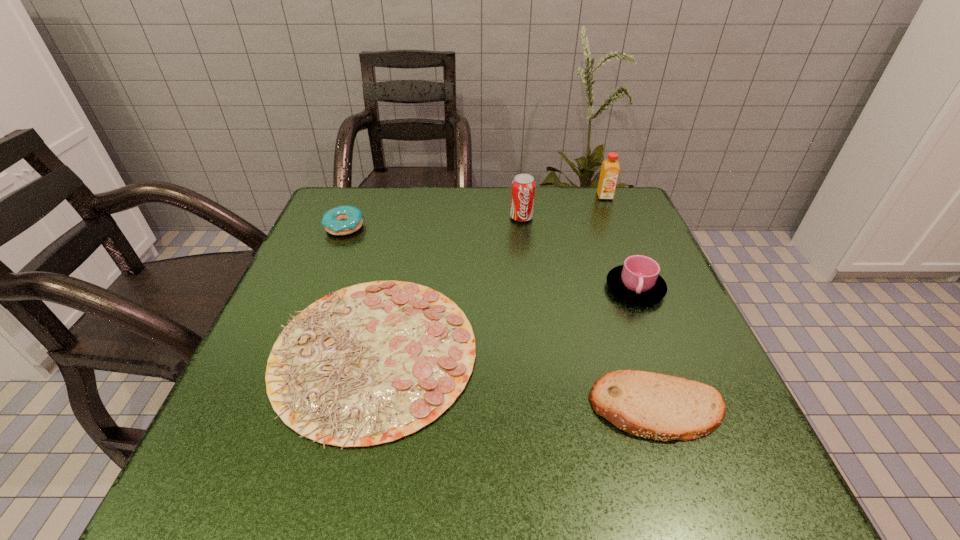
Locate an element on the screen. This screenshot has width=960, height=540. vacant region at the far left corner is located at coordinates (385, 192).

Find the location of a particular element. The width and height of the screenshot is (960, 540). free space at the near left corner is located at coordinates (194, 478).

Locate an element on the screen. This screenshot has height=540, width=960. vacant region at the far right corner of the desktop is located at coordinates (627, 195).

Locate an element on the screen. This screenshot has height=540, width=960. free point between the doughnut and the pita bread is located at coordinates (501, 318).

This screenshot has height=540, width=960. I want to click on blank region between the orange juice and the pizza, so click(490, 275).

I want to click on free space between the doughnut and the cup, so click(490, 258).

You are a GUI agent. You are given a task and a screenshot of the screen. Output one action in this format:
    pyautogui.click(x=<x>, y=<y>)
    Task: Click on the vacant region between the pita bread and the pizza
    
    Given the screenshot: What is the action you would take?
    pyautogui.click(x=516, y=381)

Image resolution: width=960 pixels, height=540 pixels. Find the location of `vacant space that's between the soda can and the doughnut`. vacant space that's between the soda can and the doughnut is located at coordinates (433, 222).

Locate an element on the screen. Image resolution: width=960 pixels, height=540 pixels. vacant area between the farthest object and the third tallest object is located at coordinates (620, 242).

The image size is (960, 540). I want to click on free space between the cup and the doughnut, so click(x=490, y=258).